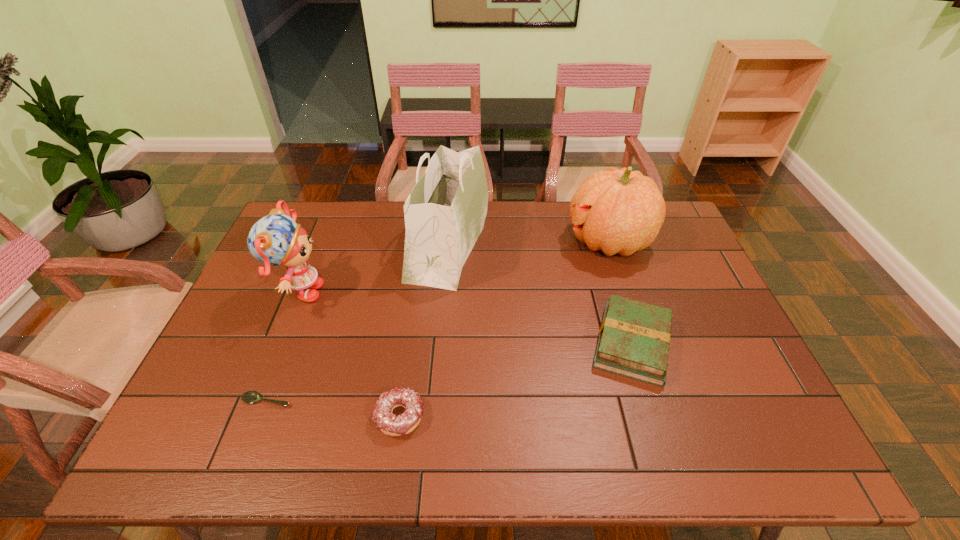
You are a GUI agent. You are given a task and a screenshot of the screen. Output one action in this format:
    pyautogui.click(x=<x>, y=<y>)
    Task: Click on the grocery bag
    Image resolution: width=960 pixels, height=540 pixels.
    Given the screenshot: What is the action you would take?
    pyautogui.click(x=445, y=212)

Locate an element on the screen. pumpkin is located at coordinates (621, 211).

Locate an element on the screen. The image size is (960, 540). doll is located at coordinates (276, 239).

Where is `book`? book is located at coordinates (634, 338).

At what (x,y) coordinates should I click in order to perform the action: click on doughnut. Please return your answer as a coordinate pair (x, y). This screenshot has height=540, width=960. Looking at the image, I should click on (390, 424).

Where is `soupspoon`? The height and width of the screenshot is (540, 960). soupspoon is located at coordinates (251, 396).

Identify the location of free spot located 0.220m on the left of the grocery bag. The width and height of the screenshot is (960, 540). (343, 242).

This screenshot has width=960, height=540. Find the location of `vacant point located 0.120m on the carved face of the pumpkin`. vacant point located 0.120m on the carved face of the pumpkin is located at coordinates [531, 241].

Image resolution: width=960 pixels, height=540 pixels. Identify the location of vacant region located 0.200m on the carved face of the pumpkin. click(x=507, y=241).

What are the coordinates of `vacant space located 0.280m on the carved face of the pumpkin` in the screenshot? It's located at (483, 241).